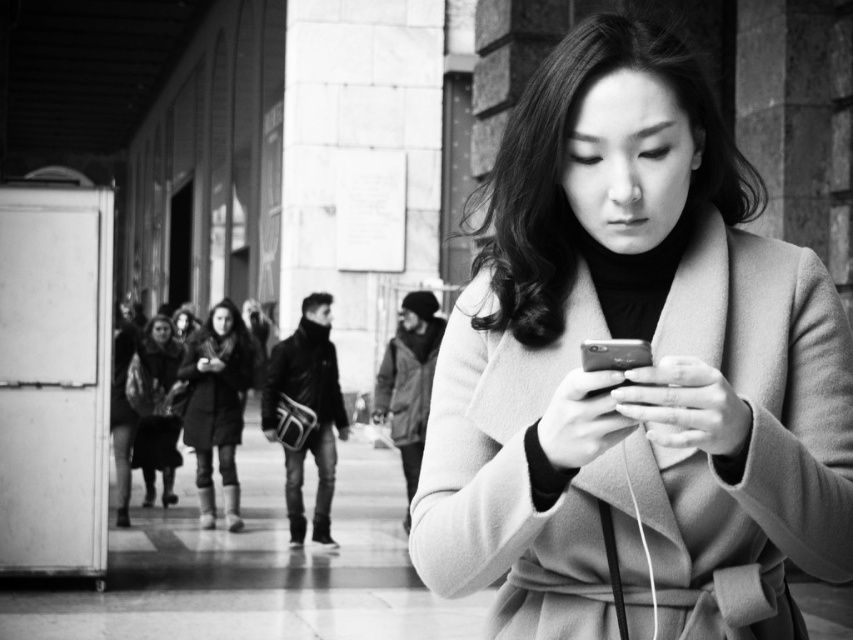
You are a fashion designer observing the scene. You notice the smooth beige coat at center and the leather jacket at center. Which clothing item is positioned higher on the person?

The smooth beige coat at center is above the leather jacket at center, so the smooth beige coat at center is positioned higher on the person.